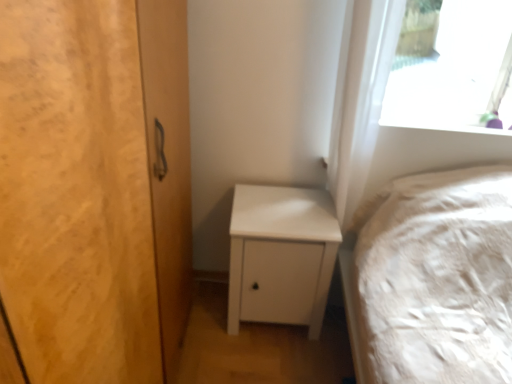
Looking at this image, in order to face white matte nightstand at lower center, should I rotate leftwards or rightwards?

Rotate right and turn 3.230 degrees.

This screenshot has width=512, height=384. What do you see at coordinates (281, 255) in the screenshot?
I see `white matte nightstand at lower center` at bounding box center [281, 255].

Locate an element on the screen. The width and height of the screenshot is (512, 384). white matte nightstand at lower center is located at coordinates (281, 255).

The image size is (512, 384). I want to click on white matte nightstand at lower center, so click(281, 255).